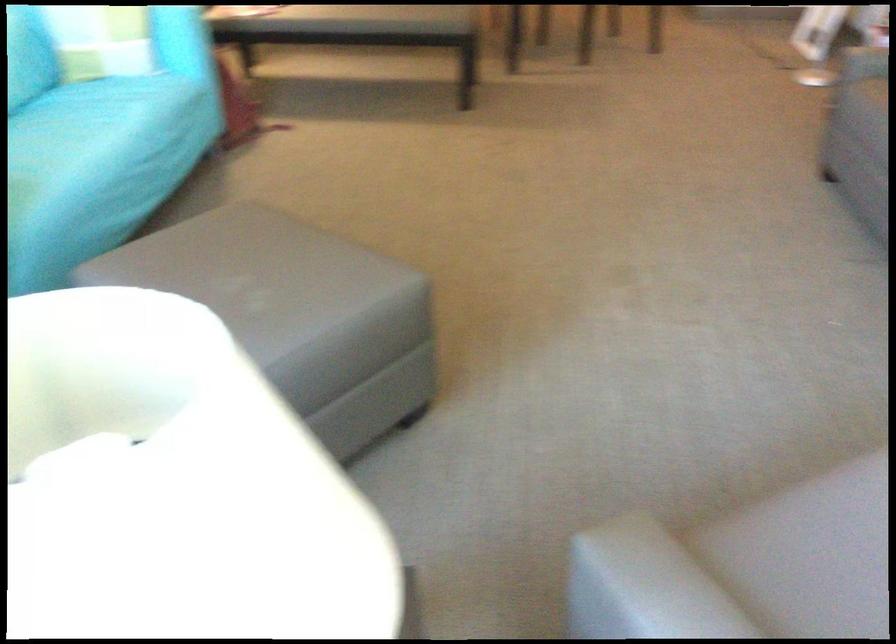
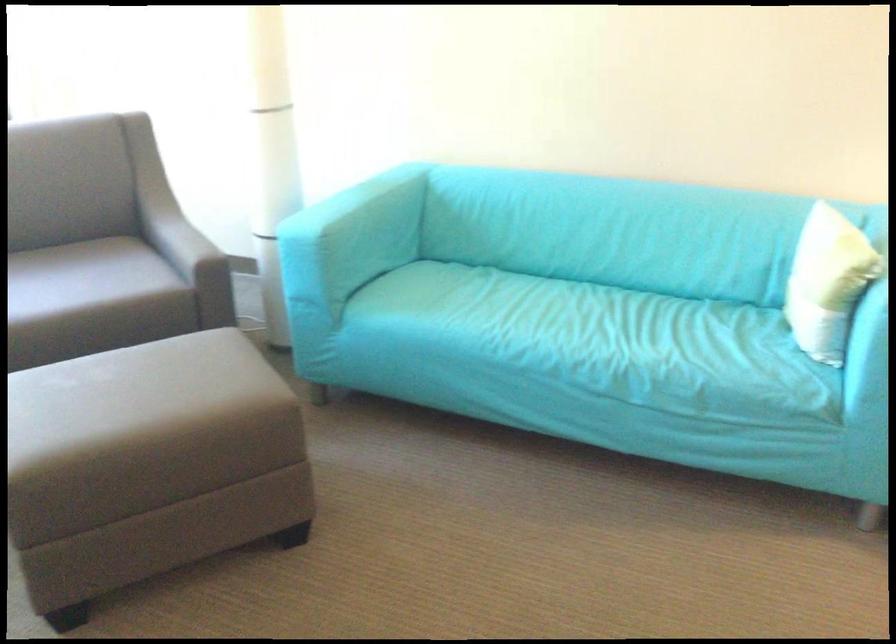
Locate, in the second image, the point that corresponds to pixel 332 247 in the first image.

(149, 464)